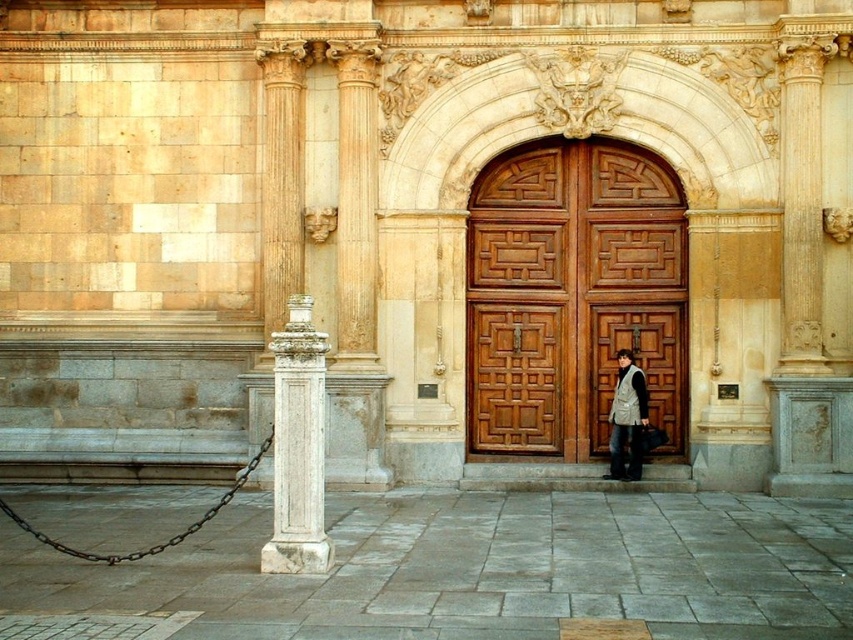
Question: Observing the image, what is the correct spatial positioning of wooden at center in reference to light gray textured vest at center?

Choices:
 (A) right
 (B) left

Answer: (B)

Question: Which point is farther to the camera?

Choices:
 (A) (611, 417)
 (B) (482, 381)

Answer: (B)

Question: Is wooden at center below white marble pillar at left?

Choices:
 (A) yes
 (B) no

Answer: (B)

Question: Estimate the real-world distances between objects in this image. Which object is closer to the white marble pillar at left?

Choices:
 (A) wooden at center
 (B) light gray textured vest at center

Answer: (B)

Question: Observing the image, what is the correct spatial positioning of white marble pillar at left in reference to light gray textured vest at center?

Choices:
 (A) above
 (B) below

Answer: (B)

Question: Which object is closer to the camera taking this photo?

Choices:
 (A) light gray textured vest at center
 (B) wooden at center

Answer: (A)